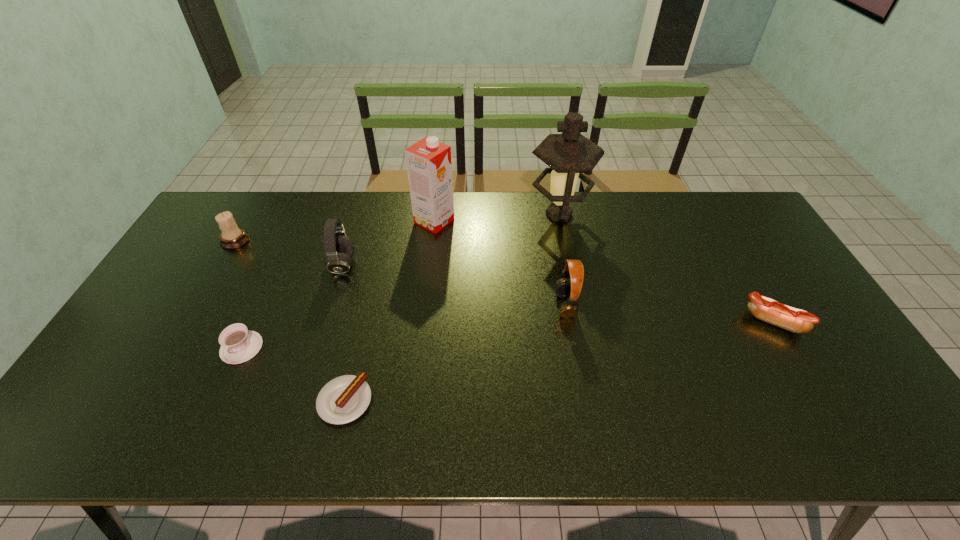
Where is `free location located 0.060m on the front of the leftmost object`? The height and width of the screenshot is (540, 960). free location located 0.060m on the front of the leftmost object is located at coordinates (223, 263).

Find the location of a particular element. The height and width of the screenshot is (540, 960). free space located on the left of the sixth tallest object is located at coordinates (670, 322).

The height and width of the screenshot is (540, 960). Identify the location of blank space located 0.110m on the handle side of the teacup. (216, 405).

This screenshot has height=540, width=960. Find the location of `blank space located 0.350m on the left of the shortest object`. blank space located 0.350m on the left of the shortest object is located at coordinates (171, 401).

What are the coordinates of `oil lamp that is at the far edge` in the screenshot? It's located at (570, 154).

This screenshot has height=540, width=960. I want to click on carton that is at the far edge, so click(428, 161).

You are a GUI agent. You are given a task and a screenshot of the screen. Output one action in this format:
    pyautogui.click(x=<x>, y=<y>)
    Task: Click on the candle holder present at the far edge
    
    Given the screenshot: What is the action you would take?
    pyautogui.click(x=232, y=237)

The image size is (960, 540). Identify the location of object that is positioned at the near edge. (342, 400).

The image size is (960, 540). I want to click on object that is at the left edge, so click(x=232, y=237).

You are a GUI agent. You are given a task and a screenshot of the screen. Output one action in this format:
    pyautogui.click(x=<x>, y=<y>)
    Task: Click on the object that is at the right edge
    
    Given the screenshot: What is the action you would take?
    pyautogui.click(x=766, y=309)